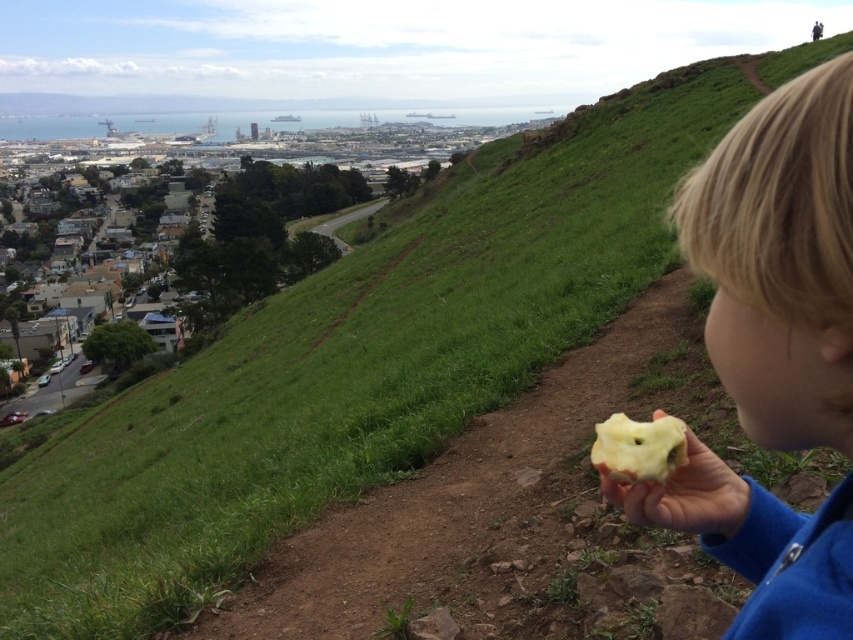
You are standing at the viewpoint where the person is holding the apple. You want to move towards the point that is closer to you. Which point should you move towards, point (772, 225) or point (656, 438)?

You should move towards point (772, 225) because it is closer to the viewer than point (656, 438).